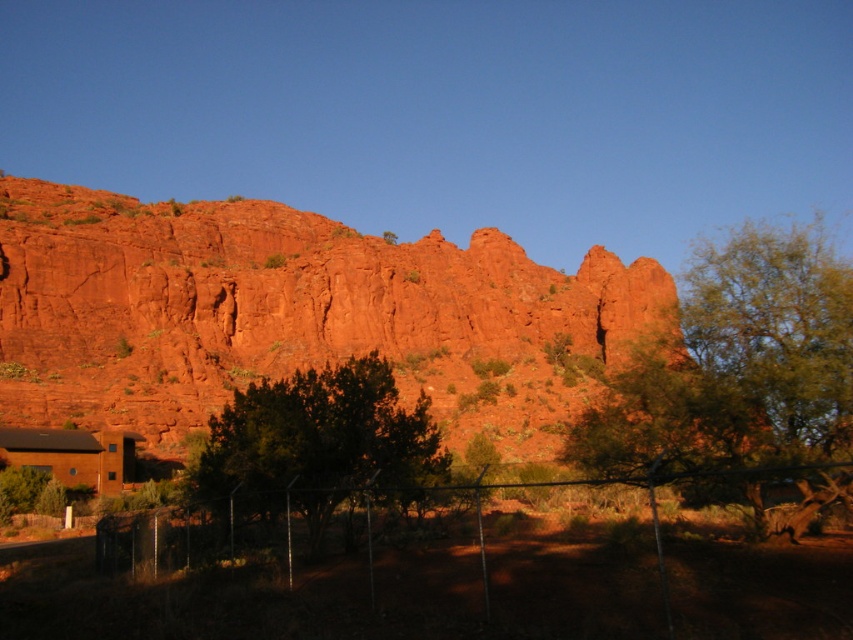
Question: Can you confirm if green leafy tree at center-right is positioned above metallic chain-link fence at lower center?

Choices:
 (A) no
 (B) yes

Answer: (B)

Question: In this image, where is rustic rock formation at center located relative to green leafy tree at center-right?

Choices:
 (A) right
 (B) left

Answer: (B)

Question: Which object is the closest to the green leafy tree at center?

Choices:
 (A) rustic rock formation at center
 (B) green leafy tree at center-right

Answer: (B)

Question: Which is farther from the rustic rock formation at center?

Choices:
 (A) green leafy tree at center-right
 (B) green leafy tree at center
 (C) metallic chain-link fence at lower center

Answer: (C)

Question: Is rustic rock formation at center further to camera compared to green leafy tree at center?

Choices:
 (A) no
 (B) yes

Answer: (B)

Question: Which object appears farthest from the camera in this image?

Choices:
 (A) green leafy tree at center-right
 (B) green leafy tree at center
 (C) metallic chain-link fence at lower center

Answer: (B)